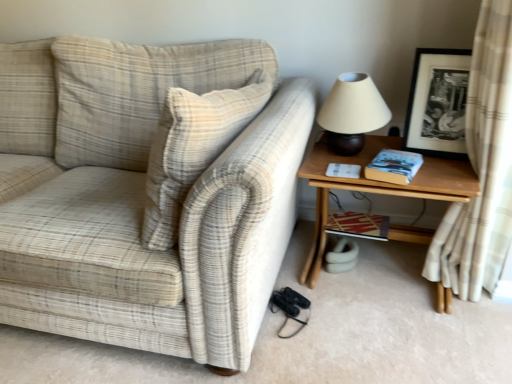
Identify the location of free space between black matte picture frame at upper right and hardcover book at right, the first book viewed from the front. (440, 168).